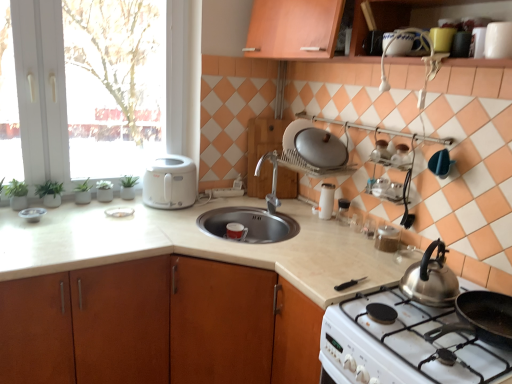
Image resolution: width=512 pixels, height=384 pixels. What are the coordinates of `vacant region in front of green matte plant at left` in the screenshot? It's located at (37, 210).